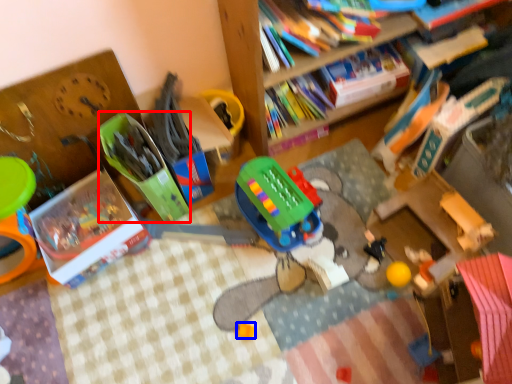
Question: Among these objects, which one is nearest to the camera, toy (highlighted by a red box) or toy (highlighted by a blue box)?

Choices:
 (A) toy
 (B) toy

Answer: (A)